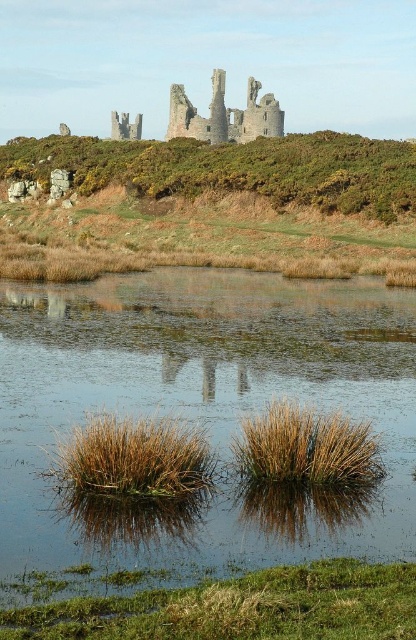
Based on the scene description, where is the brown grassy water at center positioned in relation to the other elements?

The brown grassy water at center is located at point (202, 413) in the scene.

You are standing at the edge of the water and want to walk to the brown grass at lower center. Which direction should you move relative to the brown grassy water at center?

You should move away from the brown grassy water at center because the brown grass at lower center is farther from the viewer than the brown grassy water at center.

You are an architect designing a new pathway that needs to pass between the brown grassy water at center and the rustic stone castle at upper center. Based on their widths, which object should the pathway be closer to?

The pathway should be closer to the brown grassy water at center because its width is less than the rustic stone castle at upper center, so the narrower area would require more careful planning to ensure proper placement.